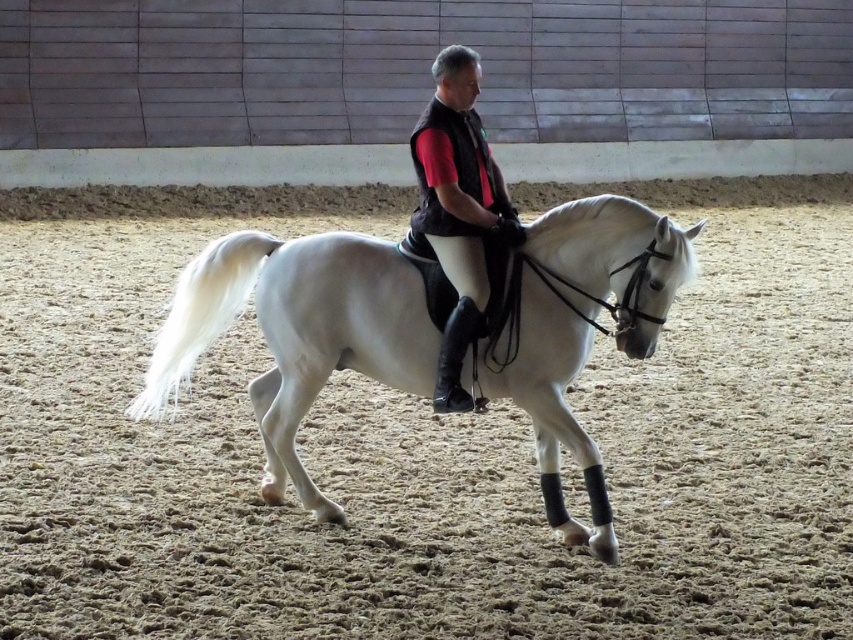
You are a photographer standing at the camera position. You want to place a small flag at point (584, 237) to mark the spot where the horse should stand during the next photo shoot. If the flag is 1.5 meters tall, will it be visible from your current position?

The distance between the camera and point (584, 237) is 6.01 meters. Since the flag is 1.5 meters tall, it will likely be visible from the photographer at 6.01 meters away as long as there are no obstructions.

You are a photographer standing at the back of the arena. You want to take a photo of the white glossy horse at center and the black matte vest at center so that they both fit in the frame. The minimum distance between the two objects to fit in the frame is 36 inches. Can you capture them in a single shot?

The white glossy horse at center and the black matte vest at center are 35.58 inches apart, which is less than the required 36 inches. Therefore, they can both fit in the frame with the current distance.

You are a photographer standing at the edge of the equestrian arena. You need to capture a photo that clearly shows both the white glossy horse at center and the black matte vest at center. Given their sizes, which object should you focus on to ensure both are in frame without needing to zoom in or out?

Since the white glossy horse at center is bigger than the black matte vest at center, you should focus on the white glossy horse at center to ensure both are in frame without needing to adjust the zoom.